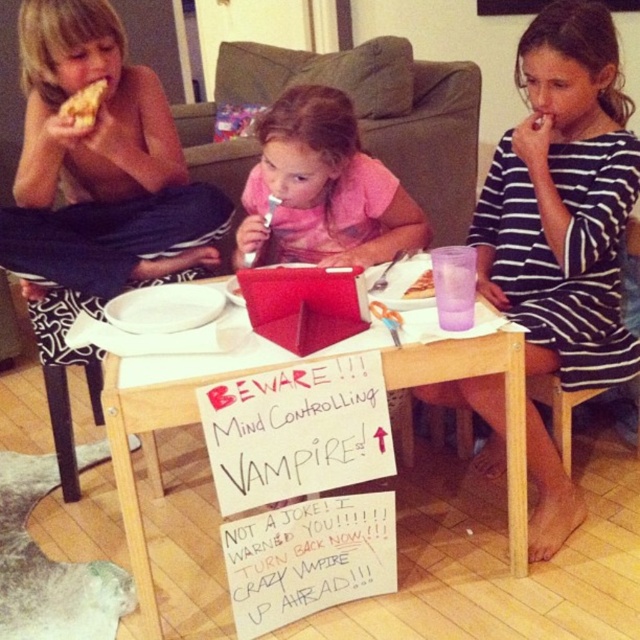
Question: Based on their relative distances, which object is farther from the pink fabric shirt at center?

Choices:
 (A) matte black shorts at left
 (B) striped fabric dress at center
 (C) wooden table at center
 (D) golden crispy pizza slice at upper left

Answer: (D)

Question: Which of the following is the closest to the observer?

Choices:
 (A) (417, 289)
 (B) (276, 228)
 (C) (67, 120)

Answer: (A)

Question: Is matte black shorts at left further to camera compared to pink fabric shirt at center?

Choices:
 (A) yes
 (B) no

Answer: (A)

Question: Does striped fabric dress at center appear over purple plastic cup at upper center?

Choices:
 (A) yes
 (B) no

Answer: (A)

Question: Is the position of matte black shorts at left more distant than that of wooden table at center?

Choices:
 (A) no
 (B) yes

Answer: (B)

Question: Which point is closer to the camera taking this photo?

Choices:
 (A) (99, 250)
 (B) (84, 116)

Answer: (B)